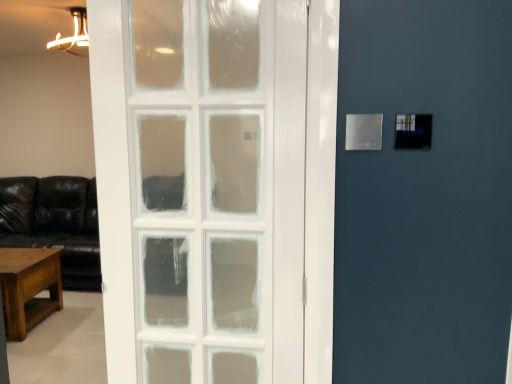
The width and height of the screenshot is (512, 384). In order to click on transparent plastic light switch at upper right in this screenshot , I will do `click(362, 131)`.

The width and height of the screenshot is (512, 384). What do you see at coordinates (362, 131) in the screenshot? I see `transparent plastic light switch at upper right` at bounding box center [362, 131].

What do you see at coordinates (29, 288) in the screenshot? Image resolution: width=512 pixels, height=384 pixels. I see `rustic wood table at lower left` at bounding box center [29, 288].

You are a GUI agent. You are given a task and a screenshot of the screen. Output one action in this format:
    pyautogui.click(x=<x>, y=<y>)
    Task: Click on the rustic wood table at lower left
    
    Given the screenshot: What is the action you would take?
    pyautogui.click(x=29, y=288)

At what (x,y) coordinates should I click in order to perform the action: click on transparent plastic light switch at upper right. Please return your answer as a coordinate pair (x, y). This screenshot has width=512, height=384. Looking at the image, I should click on (362, 131).

Does rustic wood table at lower left appear on the left side of transparent plastic light switch at upper right?

Yes, rustic wood table at lower left is to the left of transparent plastic light switch at upper right.

Between rustic wood table at lower left and transparent plastic light switch at upper right, which one is positioned behind?

Positioned behind is rustic wood table at lower left.

Does point (36, 258) come closer to viewer compared to point (371, 138)?

That is False.

From the image's perspective, is rustic wood table at lower left positioned above or below transparent plastic light switch at upper right?

rustic wood table at lower left is situated lower than transparent plastic light switch at upper right in the image.

From a real-world perspective, which object stands above the other?

transparent plastic light switch at upper right is physically above.

Between rustic wood table at lower left and transparent plastic light switch at upper right, which one has larger width?

Wider between the two is rustic wood table at lower left.

Does rustic wood table at lower left have a greater height compared to transparent plastic light switch at upper right?

Yes.

Is rustic wood table at lower left bigger or smaller than transparent plastic light switch at upper right?

Clearly, rustic wood table at lower left is larger in size than transparent plastic light switch at upper right.

Is transparent plastic light switch at upper right a part of rustic wood table at lower left?

No, transparent plastic light switch at upper right is not surrounded by rustic wood table at lower left.

Is rustic wood table at lower left in contact with transparent plastic light switch at upper right?

No, rustic wood table at lower left is not in contact with transparent plastic light switch at upper right.

Looking at this image, is rustic wood table at lower left oriented towards transparent plastic light switch at upper right?

No, rustic wood table at lower left is not facing towards transparent plastic light switch at upper right.

Consider the image. How many degrees apart are the facing directions of rustic wood table at lower left and transparent plastic light switch at upper right?

They differ by 0.342 degrees in their facing directions.

At what (x,y) coordinates should I click in order to perform the action: click on light switch on the right of rustic wood table at lower left. Please return your answer as a coordinate pair (x, y). This screenshot has width=512, height=384. Looking at the image, I should click on (362, 131).

Considering the positions of objects transparent plastic light switch at upper right and rustic wood table at lower left in the image provided, who is more to the left, transparent plastic light switch at upper right or rustic wood table at lower left?

From the viewer's perspective, rustic wood table at lower left appears more on the left side.

Considering the relative positions of transparent plastic light switch at upper right and rustic wood table at lower left in the image provided, is transparent plastic light switch at upper right in front of rustic wood table at lower left?

A: Yes.

Is point (376, 128) closer or farther from the camera than point (6, 335)?

Point (376, 128).

From the image's perspective, is transparent plastic light switch at upper right above or below rustic wood table at lower left?

Clearly, from the image's perspective, transparent plastic light switch at upper right is above rustic wood table at lower left.

From a real-world perspective, which object stands above the other?

transparent plastic light switch at upper right.

Between transparent plastic light switch at upper right and rustic wood table at lower left, which one has larger width?

rustic wood table at lower left.

In the scene shown: Can you confirm if transparent plastic light switch at upper right is taller than rustic wood table at lower left?

No.

Who is smaller, transparent plastic light switch at upper right or rustic wood table at lower left?

Smaller between the two is transparent plastic light switch at upper right.

Is transparent plastic light switch at upper right completely or partially outside of rustic wood table at lower left?

transparent plastic light switch at upper right lies outside rustic wood table at lower left's area.

Would you consider transparent plastic light switch at upper right to be distant from rustic wood table at lower left?

That's right, there is a large distance between transparent plastic light switch at upper right and rustic wood table at lower left.

Is transparent plastic light switch at upper right oriented away from rustic wood table at lower left?

transparent plastic light switch at upper right is not turned away from rustic wood table at lower left.

This screenshot has width=512, height=384. Identify the location of light switch in front of the rustic wood table at lower left. (362, 131).

This screenshot has width=512, height=384. Find the location of `table that is on the left side of transparent plastic light switch at upper right`. table that is on the left side of transparent plastic light switch at upper right is located at coordinates (29, 288).

The width and height of the screenshot is (512, 384). I want to click on table that appears below the transparent plastic light switch at upper right (from the image's perspective), so click(x=29, y=288).